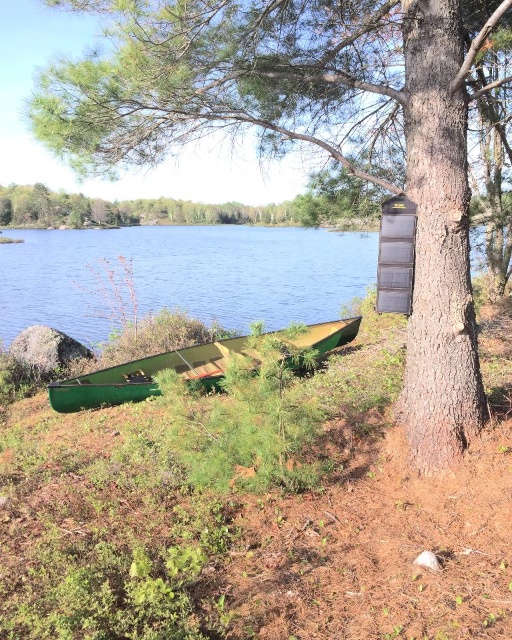
Between smooth bark tree at center and green matte canoe at lower left, which one has more height?

With more height is smooth bark tree at center.

Does smooth bark tree at center have a greater width compared to green matte canoe at lower left?

Correct, the width of smooth bark tree at center exceeds that of green matte canoe at lower left.

Is point (441, 228) behind point (126, 392)?

That is False.

The image size is (512, 640). Find the location of `smooth bark tree at center`. smooth bark tree at center is located at coordinates (310, 132).

Who is higher up, green wood water at lower left or green matte canoe at lower left?

green wood water at lower left is above.

Image resolution: width=512 pixels, height=640 pixels. Identify the location of green wood water at lower left. 181,275.

Is smooth bark tree at center to the right of green wood water at lower left from the viewer's perspective?

Correct, you'll find smooth bark tree at center to the right of green wood water at lower left.

Which is more to the right, smooth bark tree at center or green wood water at lower left?

smooth bark tree at center is more to the right.

Is point (441, 92) closer to camera compared to point (31, 250)?

Yes.

Identify the location of smooth bark tree at center. (310, 132).